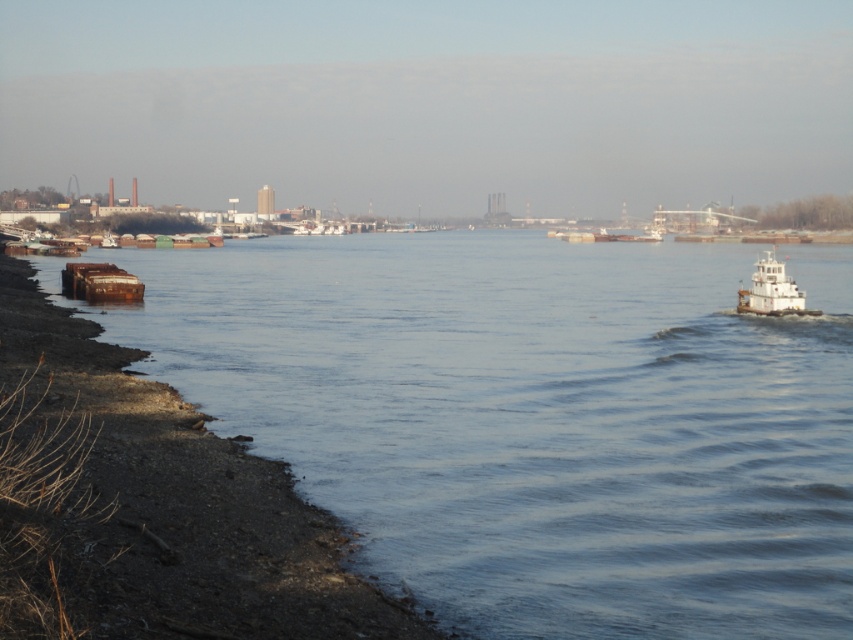
Looking at this image, is blue water at lower left positioned at the back of rusty metal barge at left?

Yes, it is behind rusty metal barge at left.

What do you see at coordinates (532, 419) in the screenshot? I see `blue water at lower left` at bounding box center [532, 419].

The height and width of the screenshot is (640, 853). I want to click on blue water at lower left, so click(x=532, y=419).

The width and height of the screenshot is (853, 640). Describe the element at coordinates (165, 509) in the screenshot. I see `rusty metal barge at left` at that location.

Describe the element at coordinates (165, 509) in the screenshot. I see `rusty metal barge at left` at that location.

Locate an element on the screen. rusty metal barge at left is located at coordinates (165, 509).

Does rusty metal barge at left appear under white matte tugboat at right?

Indeed, rusty metal barge at left is positioned under white matte tugboat at right.

Does rusty metal barge at left have a greater height compared to white matte tugboat at right?

Yes.

The height and width of the screenshot is (640, 853). What are the coordinates of `rusty metal barge at left` in the screenshot? It's located at (165, 509).

At what (x,y) coordinates should I click in order to perform the action: click on rusty metal barge at left. Please return your answer as a coordinate pair (x, y). This screenshot has height=640, width=853. Looking at the image, I should click on (165, 509).